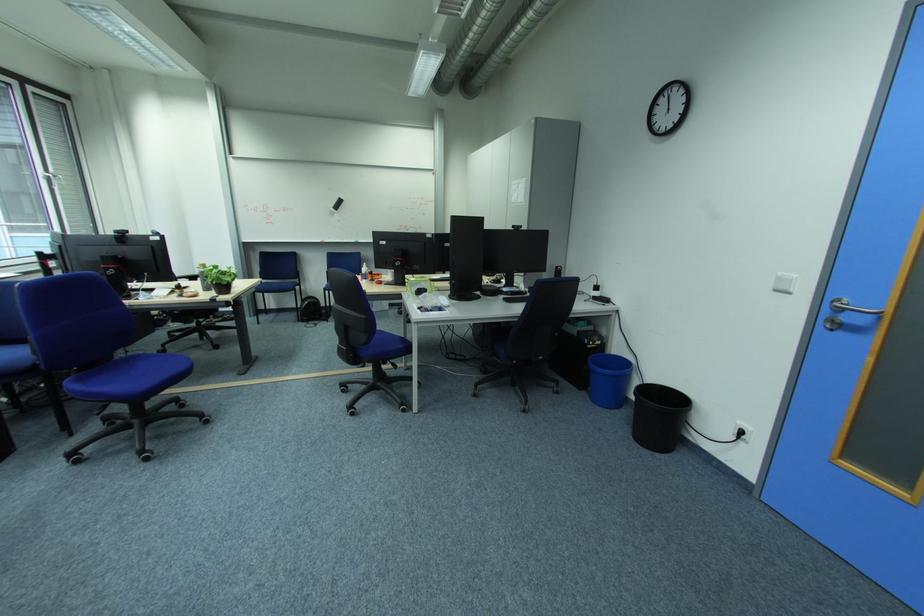
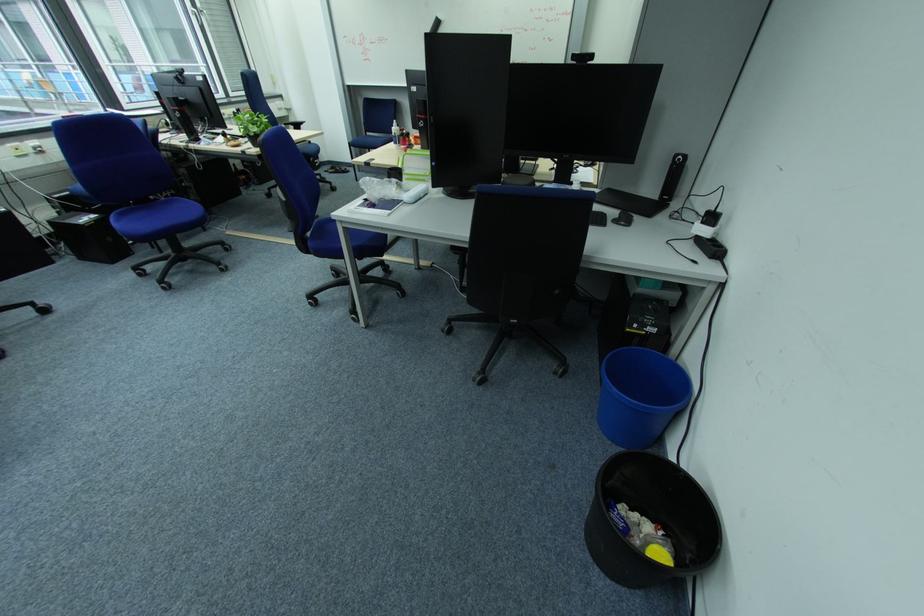
Locate, in the second image, the point that corresponds to (617,411) in the first image.

(618, 444)